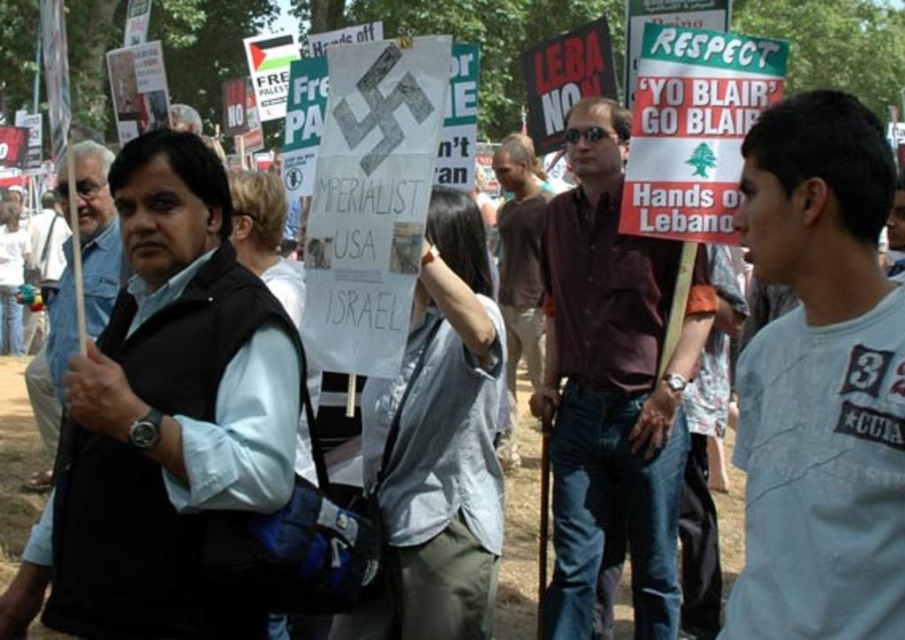
Question: Does white cotton t-shirt at center appear under black matte vest at left?

Choices:
 (A) yes
 (B) no

Answer: (A)

Question: Does white cotton t-shirt at center have a lesser width compared to dark brown shirt at center?

Choices:
 (A) no
 (B) yes

Answer: (B)

Question: Which point is farther from the camera taking this photo?

Choices:
 (A) (808, 621)
 (B) (62, 291)

Answer: (B)

Question: Estimate the real-world distances between objects in this image. Which object is closer to the black matte vest at left?

Choices:
 (A) white cotton t-shirt at center
 (B) dark brown shirt at center

Answer: (A)

Question: From the image, what is the correct spatial relationship of white cotton t-shirt at center in relation to dark brown shirt at center?

Choices:
 (A) left
 (B) right

Answer: (B)

Question: Which point is farther from the camera taking this photo?

Choices:
 (A) (616, 513)
 (B) (145, 188)
 (C) (846, 346)
 (D) (46, 355)

Answer: (D)